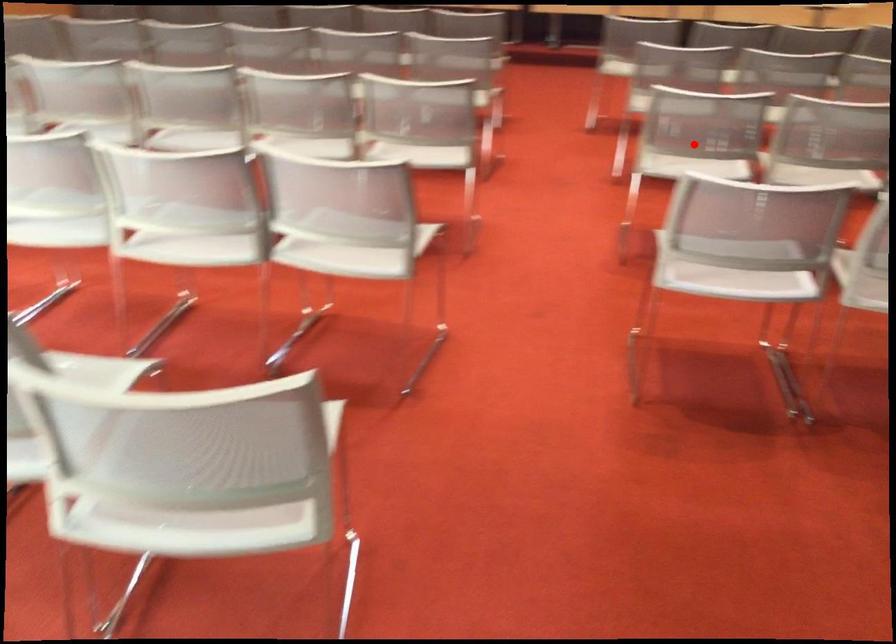
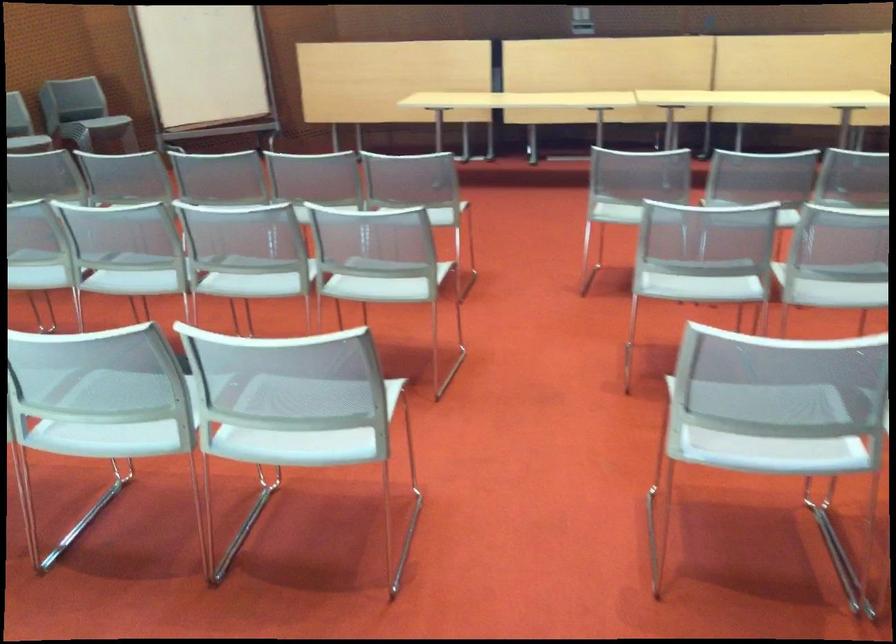
Question: I am providing you with two images of the same scene from different viewpoints. Image1 has a red point marked. In image2, the corresponding 3D location appears at what relative position? Reply with the corresponding letter.

Choices:
 (A) Closer
 (B) Farther

Answer: (A)